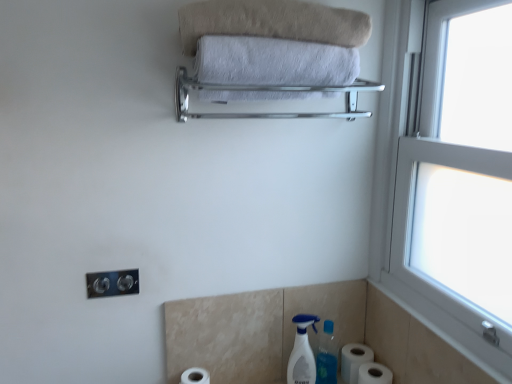
Question: Would you say white matte toilet paper at lower right, which is the 1th toilet paper in right-to-left order, is part of satin nickel outlet at lower left's contents?

Choices:
 (A) yes
 (B) no

Answer: (B)

Question: Does satin nickel outlet at lower left lie behind white matte toilet paper at lower right, the third toilet paper viewed from the left?

Choices:
 (A) yes
 (B) no

Answer: (B)

Question: From the image's perspective, is satin nickel outlet at lower left under white matte toilet paper at lower right, which is the 1th toilet paper in right-to-left order?

Choices:
 (A) yes
 (B) no

Answer: (B)

Question: From the image's perspective, is satin nickel outlet at lower left on white matte toilet paper at lower right, the third toilet paper viewed from the left?

Choices:
 (A) yes
 (B) no

Answer: (A)

Question: Is satin nickel outlet at lower left positioned in front of white matte toilet paper at lower right, the third toilet paper viewed from the left?

Choices:
 (A) yes
 (B) no

Answer: (A)

Question: Is satin nickel outlet at lower left bigger than white matte toilet paper at lower right, which is the 1th toilet paper in right-to-left order?

Choices:
 (A) no
 (B) yes

Answer: (A)

Question: Does white plastic spray bottle at lower center appear on the left side of silver metallic towel rack at upper center?

Choices:
 (A) yes
 (B) no

Answer: (B)

Question: Is silver metallic towel rack at upper center located within white plastic spray bottle at lower center?

Choices:
 (A) no
 (B) yes

Answer: (A)

Question: From a real-world perspective, does white plastic spray bottle at lower center sit lower than silver metallic towel rack at upper center?

Choices:
 (A) yes
 (B) no

Answer: (A)

Question: Is white plastic spray bottle at lower center with silver metallic towel rack at upper center?

Choices:
 (A) no
 (B) yes

Answer: (A)

Question: Would you say white plastic spray bottle at lower center is outside silver metallic towel rack at upper center?

Choices:
 (A) yes
 (B) no

Answer: (A)

Question: Is white plastic spray bottle at lower center far from silver metallic towel rack at upper center?

Choices:
 (A) yes
 (B) no

Answer: (B)

Question: Is satin nickel outlet at lower left touching beige soft towel at upper center, which is the 1th towel from top to bottom?

Choices:
 (A) no
 (B) yes

Answer: (A)